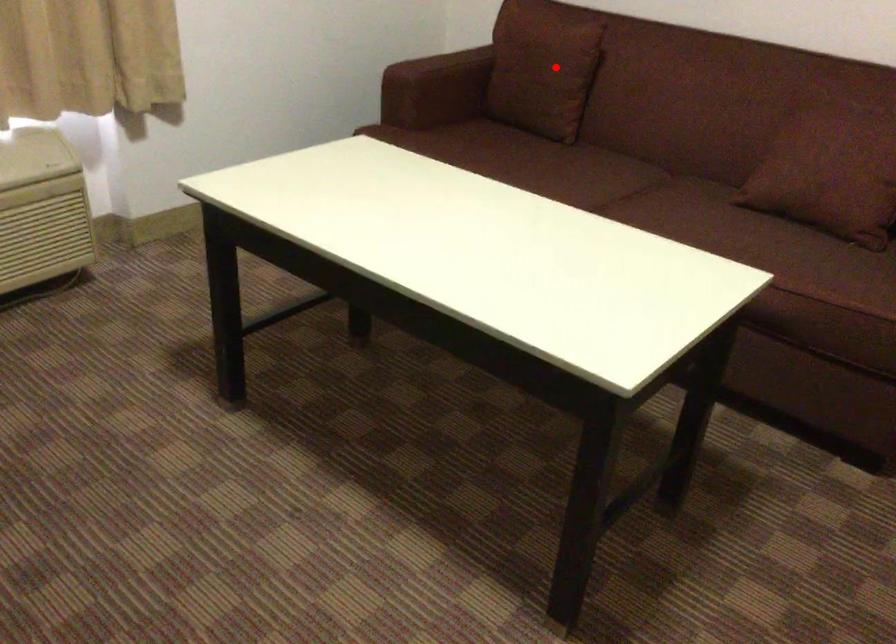
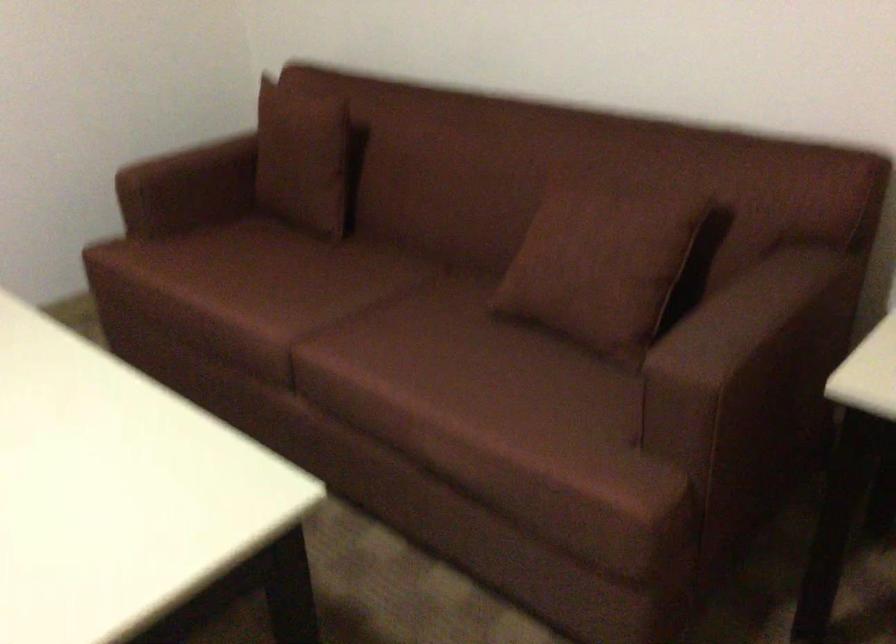
Question: I am providing you with two images of the same scene from different viewpoints. Image1 has a red point marked. In image2, the corresponding 3D location appears at what relative position? Reply with the corresponding letter.

Choices:
 (A) Closer
 (B) Farther

Answer: (A)